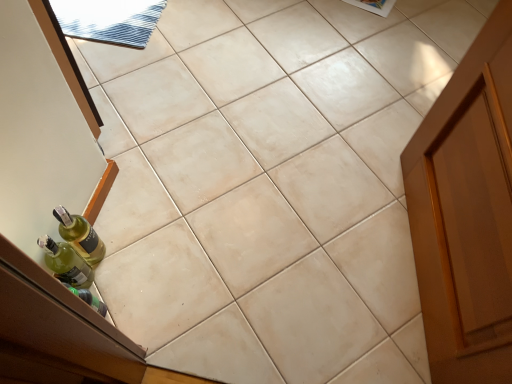
The width and height of the screenshot is (512, 384). I want to click on free space behind green glass bottle at left, marked as the 2th bottle in a top-to-bottom arrangement, so click(124, 226).